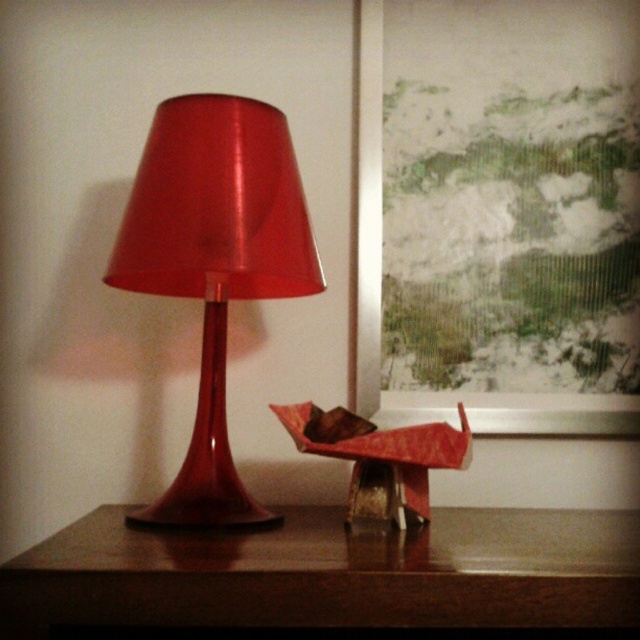
You are standing in the room and want to place a new decorative item on the wooden table at center. Where exactly should you place it according to the coordinates provided?

The wooden table at center should be placed at the 2D coordinates point [333,573].

You are standing in front of the minimalist indoor setting and want to take a photo of the scene. You notice two points marked in the image at coordinates point [99,552] and point [156,230]. Which point should you focus on to ensure the closer one is in sharp focus?

Point [99,552] is closer to the camera than point [156,230], so you should focus on point [99,552] to ensure the closer one is in sharp focus.